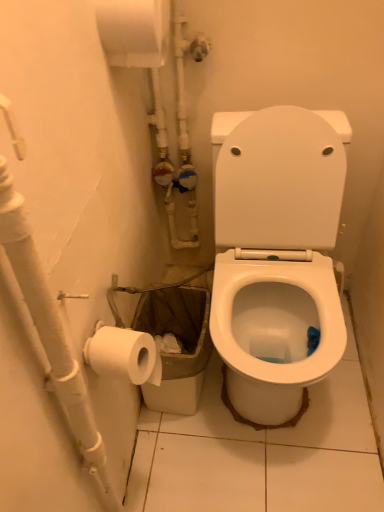
Question: Does white matte water pipe at left have a larger size compared to white matte toilet paper at upper left?

Choices:
 (A) yes
 (B) no

Answer: (A)

Question: Is white matte water pipe at left oriented away from white matte toilet paper at upper left?

Choices:
 (A) yes
 (B) no

Answer: (B)

Question: Is white matte water pipe at left not close to white matte toilet paper at upper left?

Choices:
 (A) yes
 (B) no

Answer: (B)

Question: From the image's perspective, is white matte water pipe at left above white matte toilet paper at upper left?

Choices:
 (A) yes
 (B) no

Answer: (B)

Question: Considering the relative sizes of white matte water pipe at left and white matte toilet paper at upper left in the image provided, is white matte water pipe at left thinner than white matte toilet paper at upper left?

Choices:
 (A) no
 (B) yes

Answer: (B)

Question: From the image's perspective, is white matte water pipe at left located beneath white matte toilet paper at upper left?

Choices:
 (A) yes
 (B) no

Answer: (A)

Question: From the image's perspective, is white matte toilet paper at upper left on top of white matte water pipe at left?

Choices:
 (A) no
 (B) yes

Answer: (B)

Question: Is white matte toilet paper at upper left not within white matte water pipe at left?

Choices:
 (A) no
 (B) yes

Answer: (B)

Question: From a real-world perspective, does white matte toilet paper at upper left sit lower than white matte water pipe at left?

Choices:
 (A) no
 (B) yes

Answer: (A)

Question: Is white matte toilet paper at upper left positioned with its back to white matte water pipe at left?

Choices:
 (A) no
 (B) yes

Answer: (A)

Question: Could you tell me if white matte toilet paper at upper left is turned towards white matte water pipe at left?

Choices:
 (A) yes
 (B) no

Answer: (B)

Question: Considering the relative positions of white matte toilet paper at upper left and white matte water pipe at left in the image provided, is white matte toilet paper at upper left to the left of white matte water pipe at left from the viewer's perspective?

Choices:
 (A) no
 (B) yes

Answer: (A)

Question: From a real-world perspective, is white matte water pipe at left above or below white matte toilet paper at upper left?

Choices:
 (A) above
 (B) below

Answer: (B)